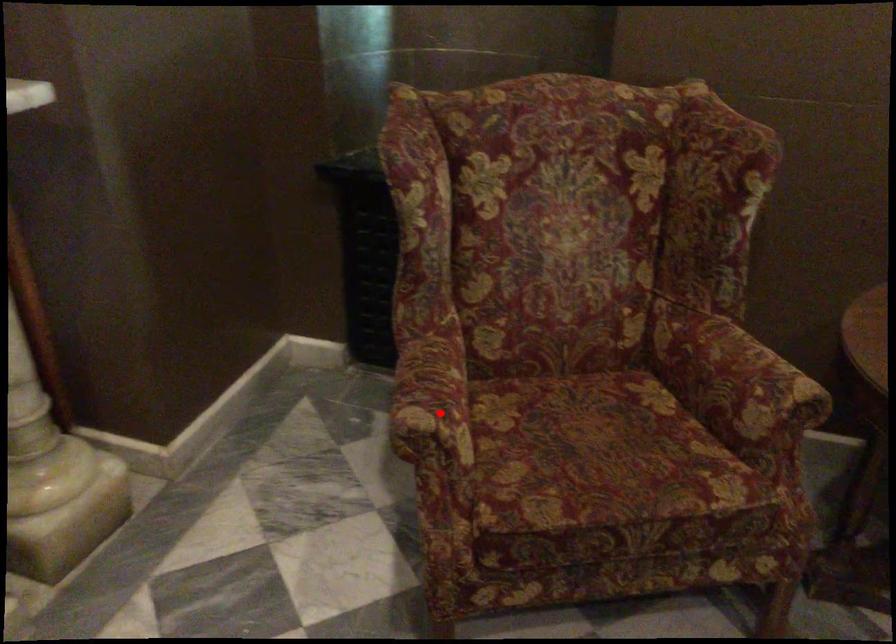
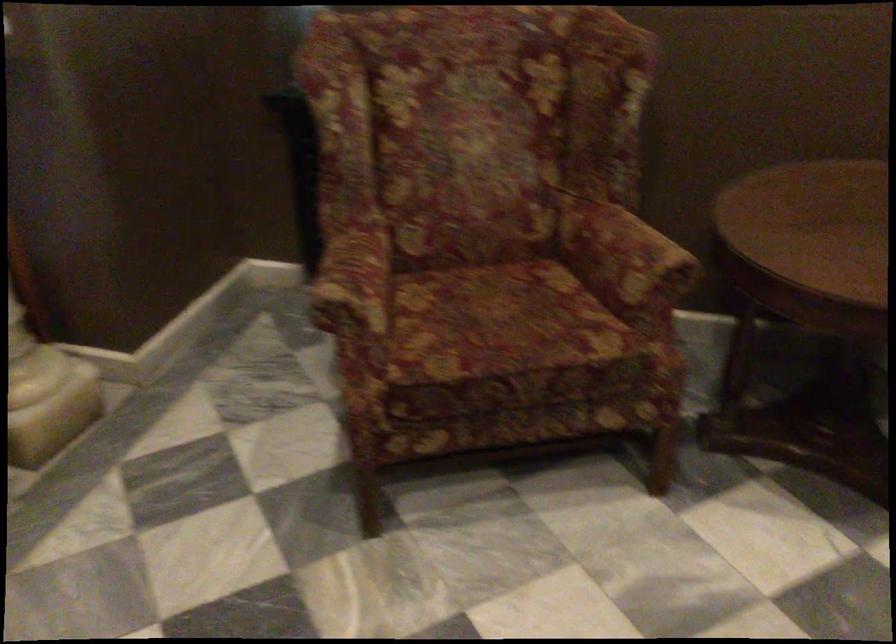
Where in the second image is the point corresponding to the highlighted location from the first image?

(355, 286)